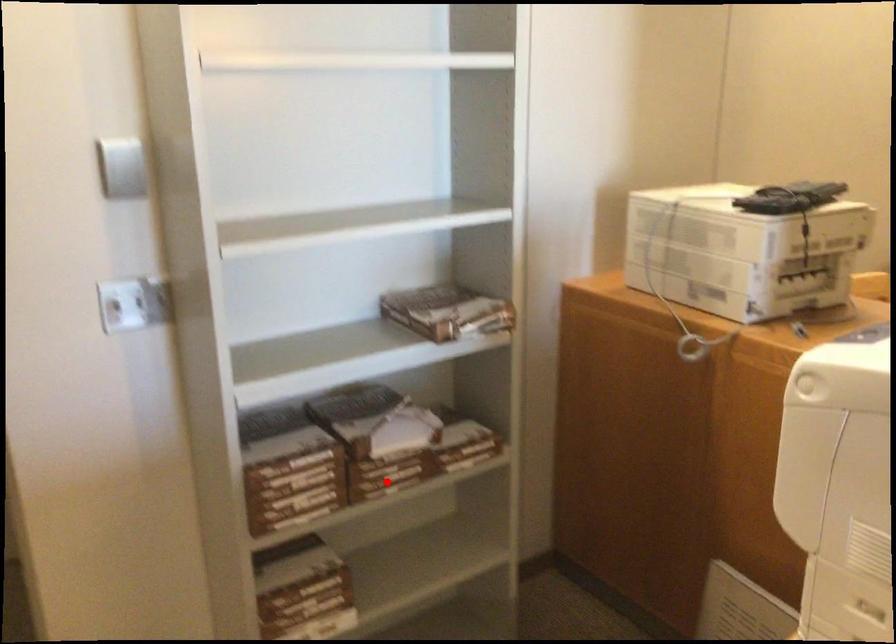
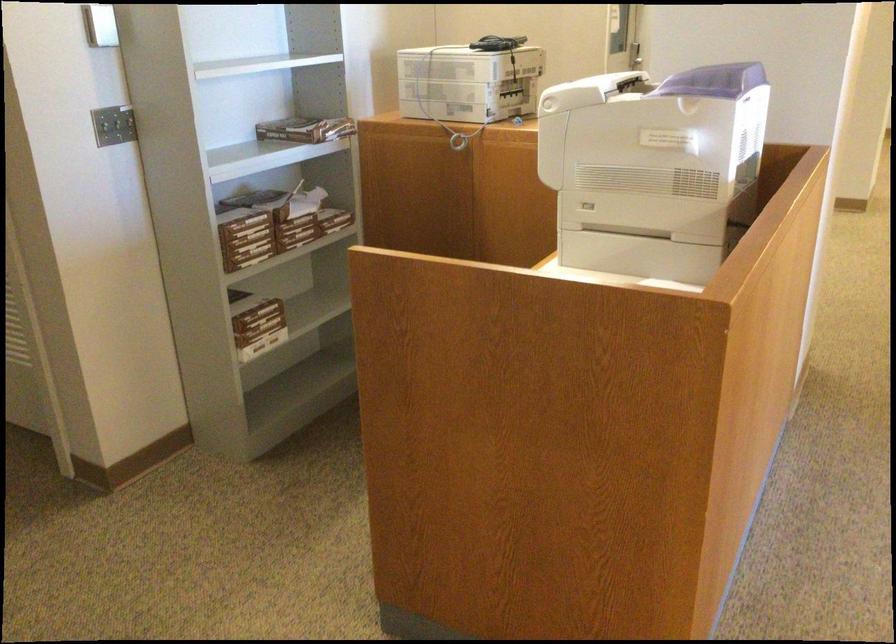
Question: I am providing you with two images of the same scene from different viewpoints. Image1 has a red point marked. In image2, the corresponding 3D location appears at what relative position? Reply with the corresponding letter.

Choices:
 (A) Closer
 (B) Farther

Answer: (B)